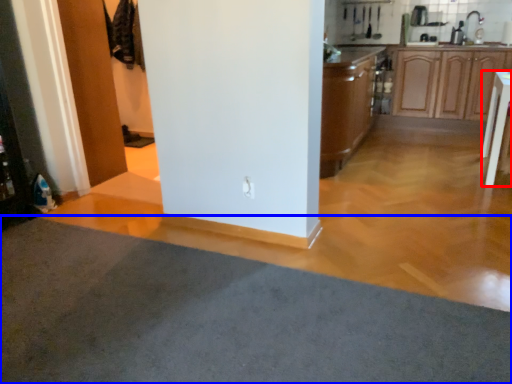
Question: Which of the following is the farthest to the observer, table (highlighted by a red box) or plain (highlighted by a blue box)?

Choices:
 (A) table
 (B) plain

Answer: (A)